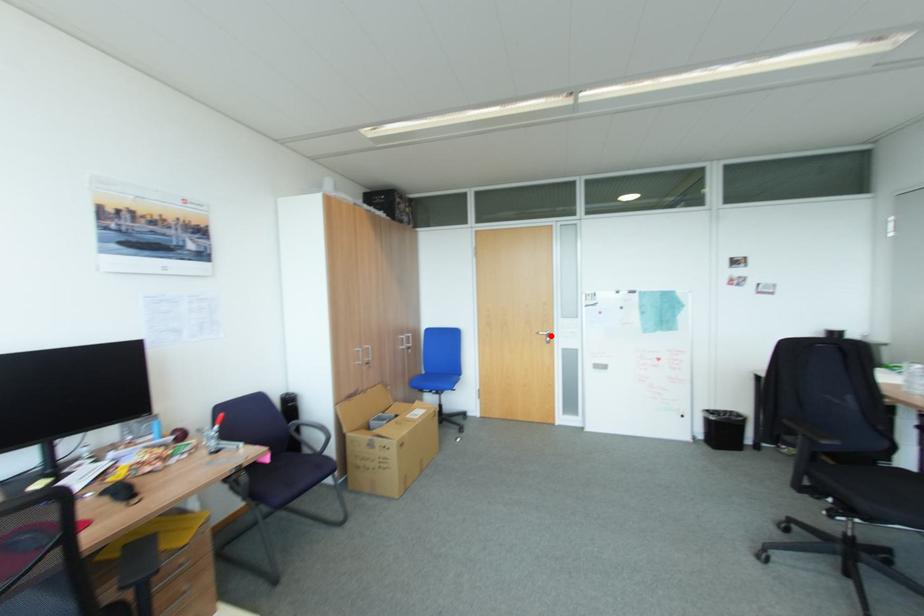
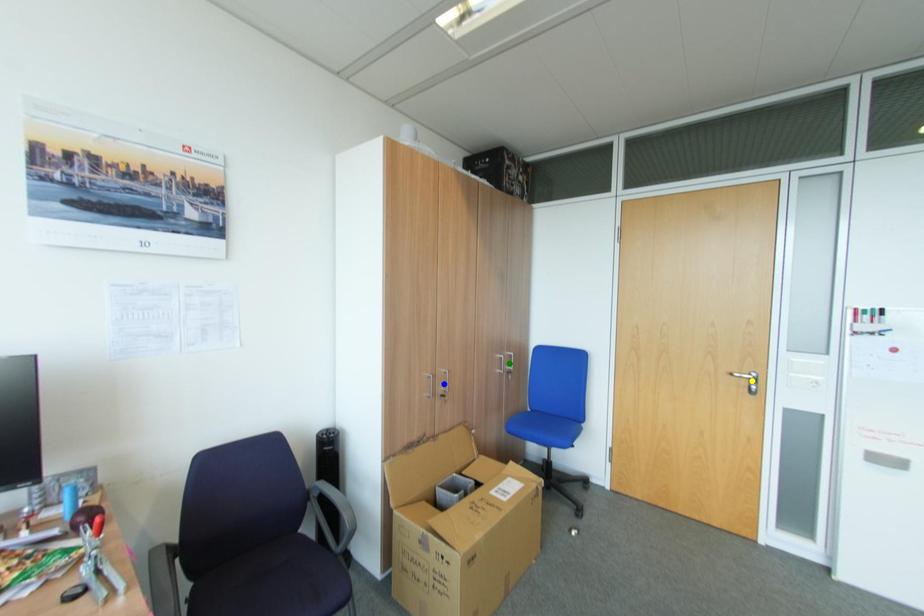
Question: I am providing you with two images of the same scene from different viewpoints. A red point is marked on the first image. You are given multiple points on the second image. Which mark in image 2 goes with the point in image 1?

Choices:
 (A) green point
 (B) yellow point
 (C) blue point

Answer: (B)